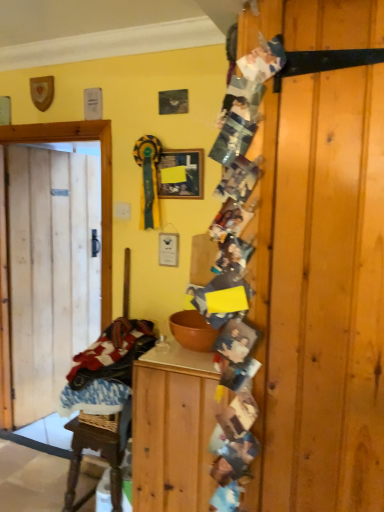
Question: Is matte black picture frame at upper center a part of natural wood door at left?

Choices:
 (A) no
 (B) yes

Answer: (A)

Question: Does natural wood door at left turn towards matte black picture frame at upper center?

Choices:
 (A) yes
 (B) no

Answer: (A)

Question: Can you confirm if natural wood door at left is taller than matte black picture frame at upper center?

Choices:
 (A) yes
 (B) no

Answer: (A)

Question: Is natural wood door at left outside matte black picture frame at upper center?

Choices:
 (A) no
 (B) yes

Answer: (B)

Question: Is natural wood door at left in front of matte black picture frame at upper center?

Choices:
 (A) yes
 (B) no

Answer: (B)

Question: From their relative heights in the image, would you say plaid fabric laundry at left is taller or shorter than matte black picture frame at upper center?

Choices:
 (A) short
 (B) tall

Answer: (B)

Question: Is plaid fabric laundry at left spatially inside matte black picture frame at upper center, or outside of it?

Choices:
 (A) outside
 (B) inside

Answer: (A)

Question: Considering the positions of plaid fabric laundry at left and matte black picture frame at upper center in the image, is plaid fabric laundry at left bigger or smaller than matte black picture frame at upper center?

Choices:
 (A) big
 (B) small

Answer: (A)

Question: From a real-world perspective, is plaid fabric laundry at left above or below matte black picture frame at upper center?

Choices:
 (A) below
 (B) above

Answer: (A)

Question: Is matte black picture frame at upper center taller or shorter than wooden cabinet at center?

Choices:
 (A) tall
 (B) short

Answer: (B)

Question: Considering their positions, is matte black picture frame at upper center located in front of or behind wooden cabinet at center?

Choices:
 (A) front
 (B) behind

Answer: (B)

Question: From a real-world perspective, is matte black picture frame at upper center physically located above or below wooden cabinet at center?

Choices:
 (A) above
 (B) below

Answer: (A)

Question: Considering the relative positions of matte black picture frame at upper center and wooden cabinet at center in the image provided, is matte black picture frame at upper center to the left or to the right of wooden cabinet at center?

Choices:
 (A) left
 (B) right

Answer: (A)

Question: Considering their positions, is matte black picture frame at upper center located in front of or behind plaid fabric laundry at left?

Choices:
 (A) behind
 (B) front

Answer: (A)

Question: Considering the positions of point (x=183, y=182) and point (x=132, y=334), is point (x=183, y=182) closer or farther from the camera than point (x=132, y=334)?

Choices:
 (A) farther
 (B) closer

Answer: (A)